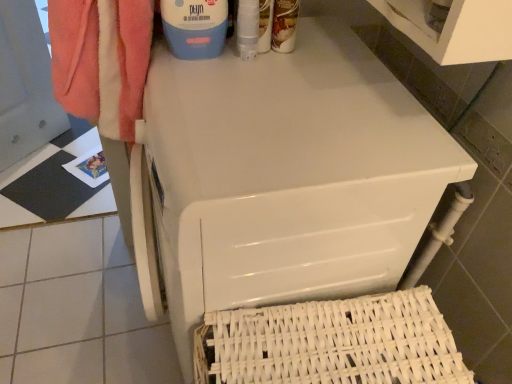
At what (x,y) coordinates should I click in order to perform the action: click on vacant region to the right of matte brown bottle at upper center, the 1th cleaning product positioned from the right. Please return your answer as a coordinate pair (x, y). Looking at the image, I should click on (336, 51).